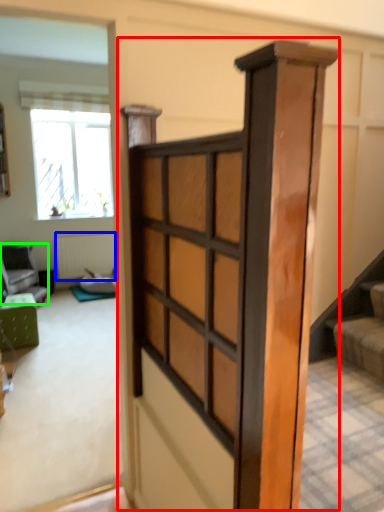
Question: Based on their relative distances, which object is farther from barn door (highlighted by a red box)? Choose from radiator (highlighted by a blue box) and furniture (highlighted by a green box).

Choices:
 (A) radiator
 (B) furniture

Answer: (A)